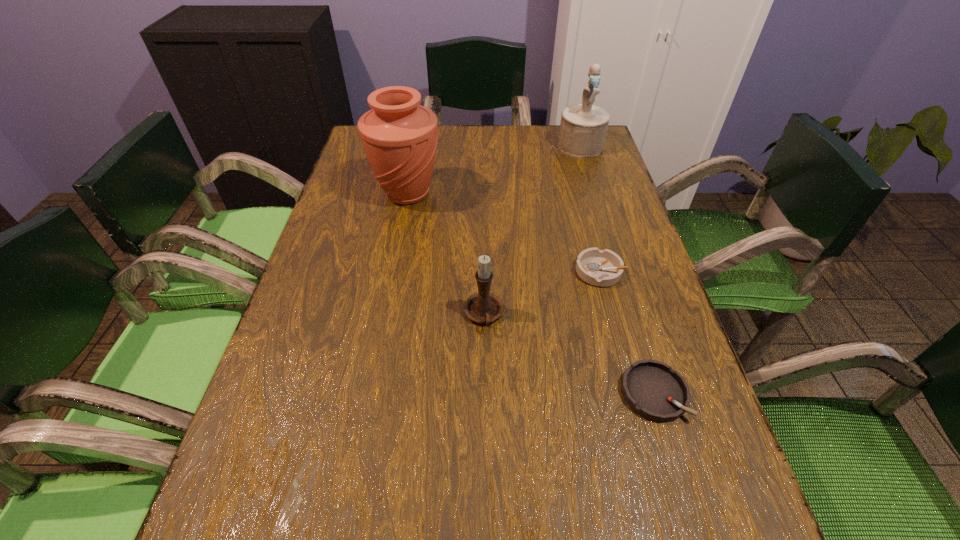
Find the location of `vase`. vase is located at coordinates (399, 136).

Locate an element on the screen. the leftmost object is located at coordinates (399, 136).

Where is `figurine`? This screenshot has width=960, height=540. figurine is located at coordinates (583, 127).

Where is `the fourth farthest object`? This screenshot has width=960, height=540. the fourth farthest object is located at coordinates (483, 307).

Find the location of `candle holder`. candle holder is located at coordinates (483, 307).

Find the location of a particular element. the nearest object is located at coordinates [x=652, y=389].

You are a GUI agent. You are given a task and a screenshot of the screen. Output one action in this format:
    pyautogui.click(x=<x>, y=<y>)
    Task: Click on the farther ashtray
    The image size is (960, 540).
    Given the screenshot: What is the action you would take?
    pyautogui.click(x=602, y=268)

Locate an element on the screen. The image size is (960, 540). vacant space located on the right of the vase is located at coordinates (491, 194).

Where is `blank space located 0.250m at the beak of the farthest object`? The height and width of the screenshot is (540, 960). blank space located 0.250m at the beak of the farthest object is located at coordinates (599, 208).

Identify the location of free point located on the side of the candle holder with the handle. (486, 491).